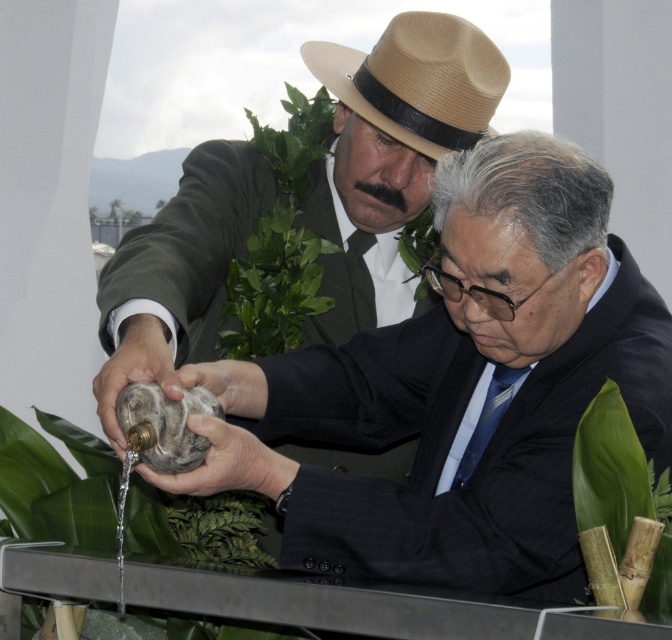
You are a photographer trying to capture a clear shot of the tan straw fedora at upper center and the green leafy plant at upper center. Which object will appear closer to the camera in the photo?

The tan straw fedora at upper center will appear closer to the camera because it is in front of the green leafy plant at upper center.

Based on the scene described, which object is positioned closer to the viewer between the matte black suit at center and the tan straw fedora at upper center?

The matte black suit at center is positioned closer to the viewer than the tan straw fedora at upper center.